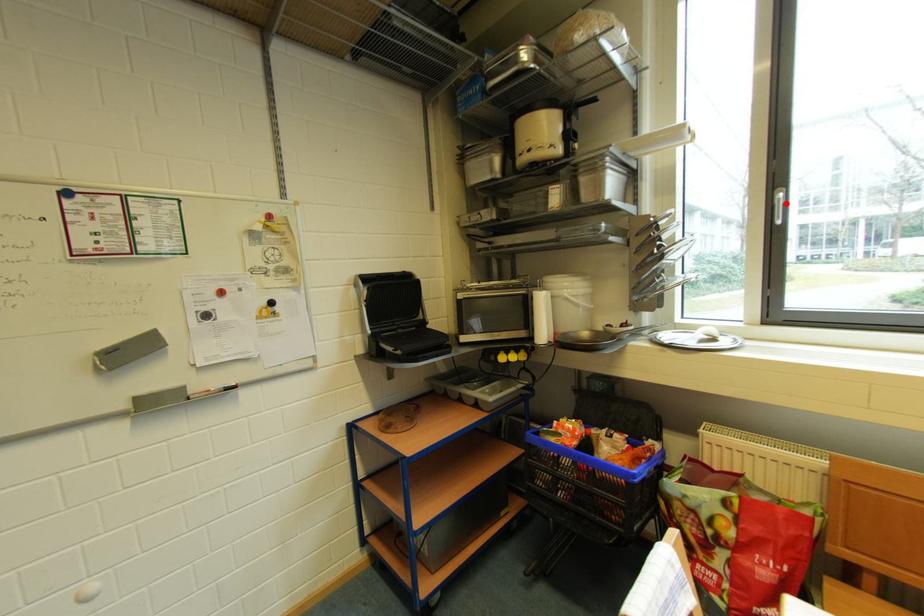
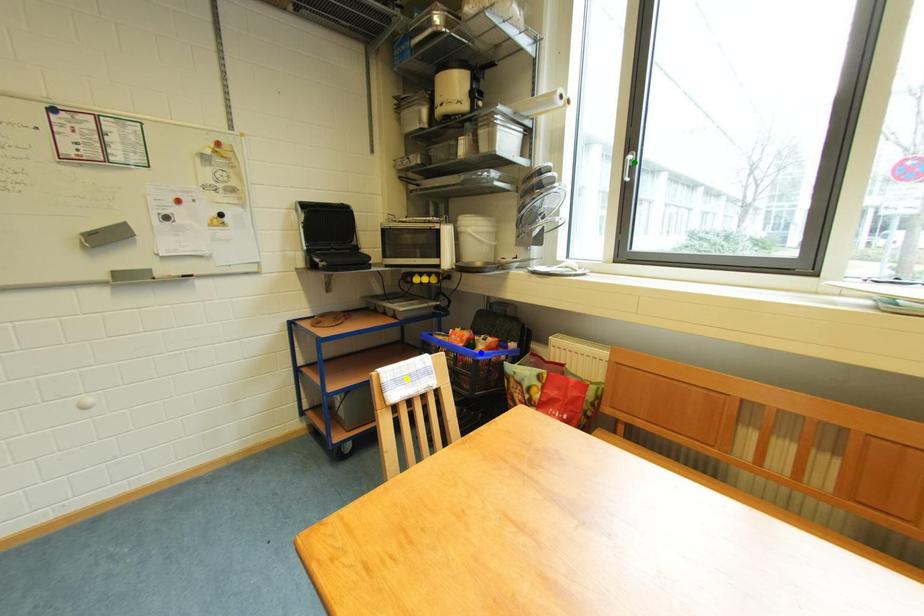
Question: I am providing you with two images of the same scene from different viewpoints. A red point is marked on the first image. You are given multiple points on the second image. Which point in image 2 represents the same 3d spot as the red point in image 1?

Choices:
 (A) yellow point
 (B) blue point
 (C) green point

Answer: (C)